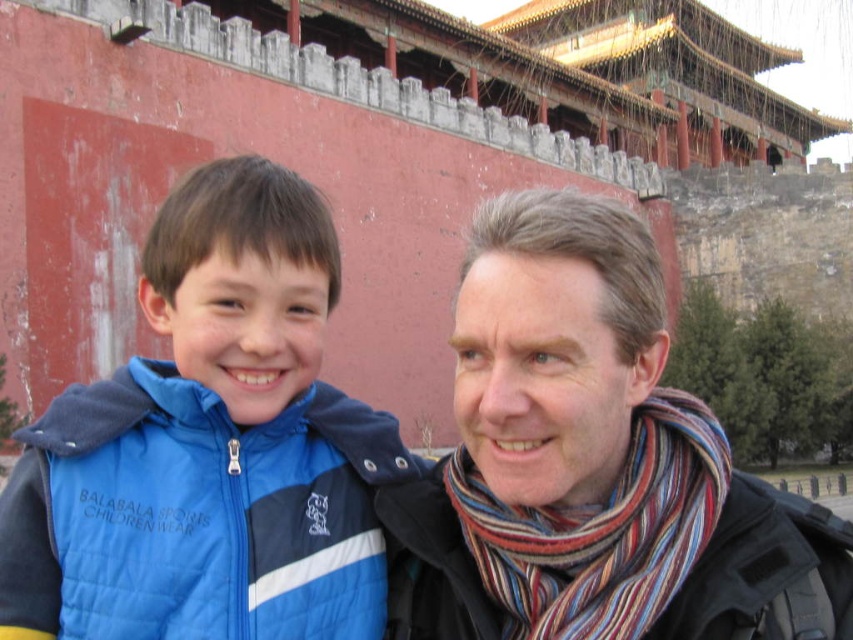
You are a photographer trying to capture a closeup of both the striped scarf at center and the striped wool scarf at right. Since you can only focus on one scarf at a time, which scarf should you choose to ensure the other is still in the background but recognizable?

You should focus on the striped scarf at center because it is bigger than the striped wool scarf at right, so even if it is in focus, the smaller striped wool scarf at right will still be recognizable in the background.

You are a photographer trying to capture a photo of the blue quilted vest at left and the striped wool scarf at right in the image. Based on their positions, which object is closer to the left side of the frame?

The blue quilted vest at left is closer to the left side of the frame than the striped wool scarf at right.